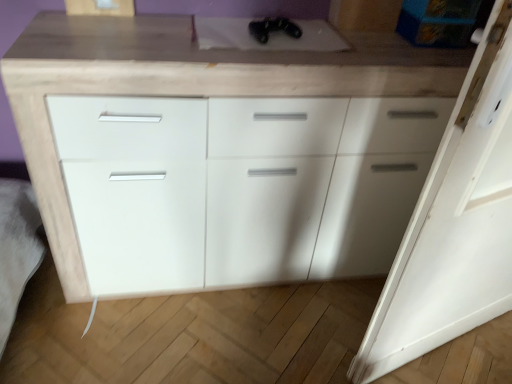
The width and height of the screenshot is (512, 384). Find the location of `vacant area situated below white matte door at right (from a real-world perspective)`. vacant area situated below white matte door at right (from a real-world perspective) is located at coordinates (445, 348).